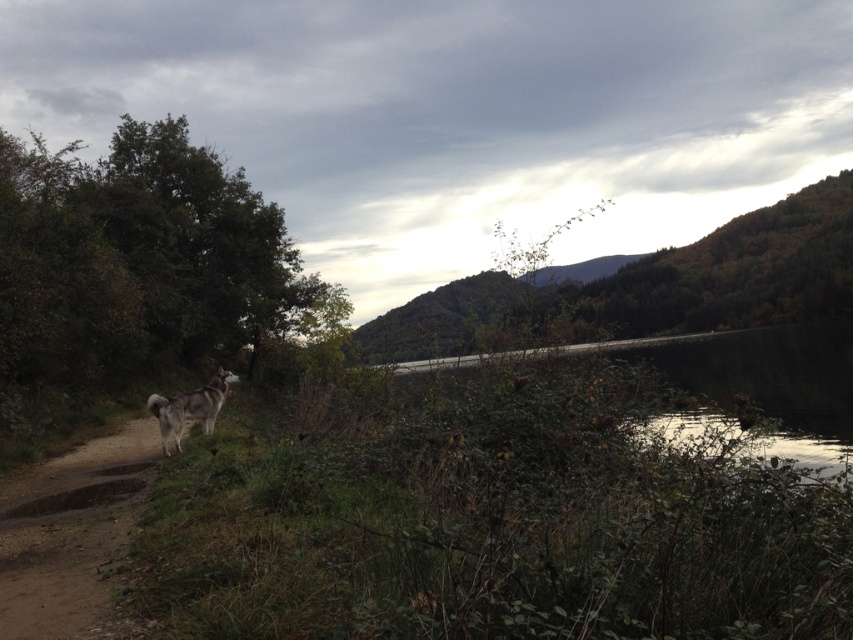
Question: Does dirt path at left have a larger size compared to white fur dog at lower left?

Choices:
 (A) yes
 (B) no

Answer: (A)

Question: Which is nearer to the smooth concrete wall at center?

Choices:
 (A) white fur dog at lower left
 (B) dirt path at left

Answer: (B)

Question: Can you confirm if smooth concrete wall at center is thinner than white fur dog at lower left?

Choices:
 (A) yes
 (B) no

Answer: (B)

Question: Which point is closer to the camera?

Choices:
 (A) white fur dog at lower left
 (B) dirt path at left

Answer: (B)

Question: Which object is farther from the camera taking this photo?

Choices:
 (A) white fur dog at lower left
 (B) dirt path at left

Answer: (A)

Question: Is dirt path at left thinner than smooth concrete wall at center?

Choices:
 (A) yes
 (B) no

Answer: (A)